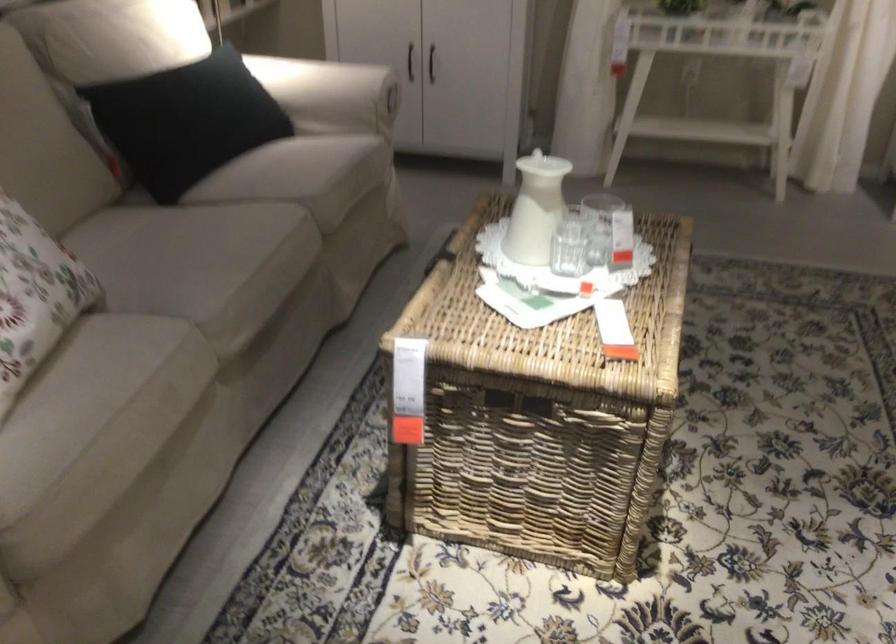
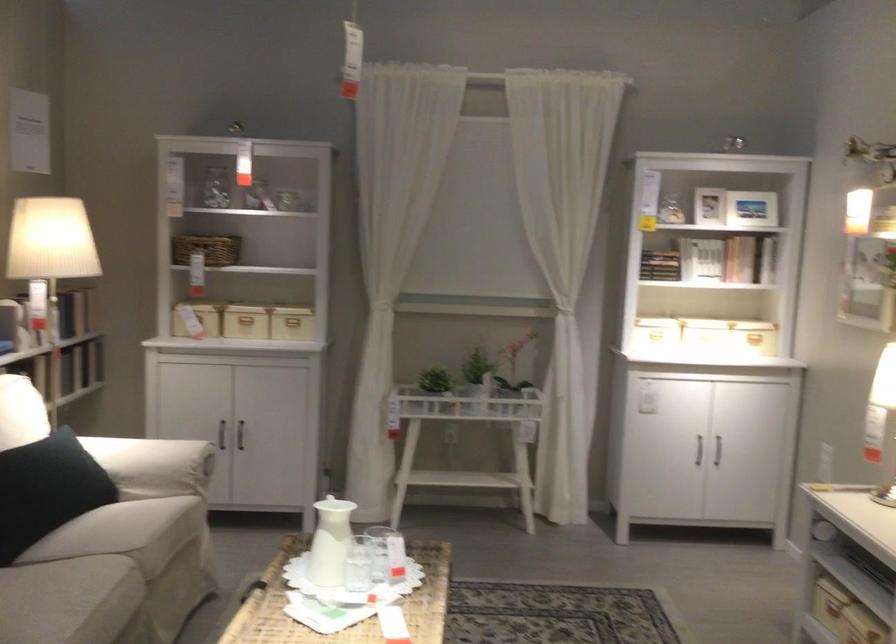
Find the pixel in the second image that matches point (272, 223) in the first image.

(110, 576)